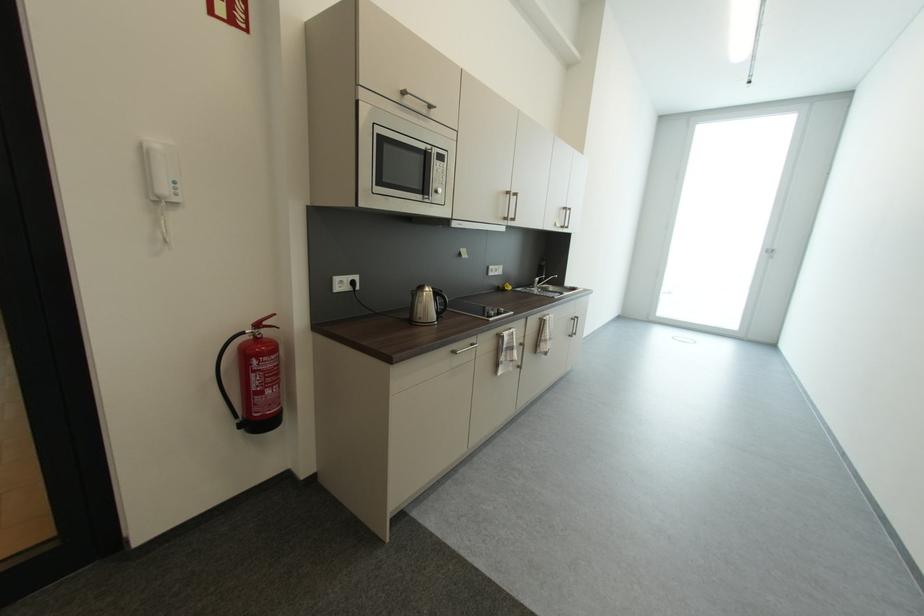
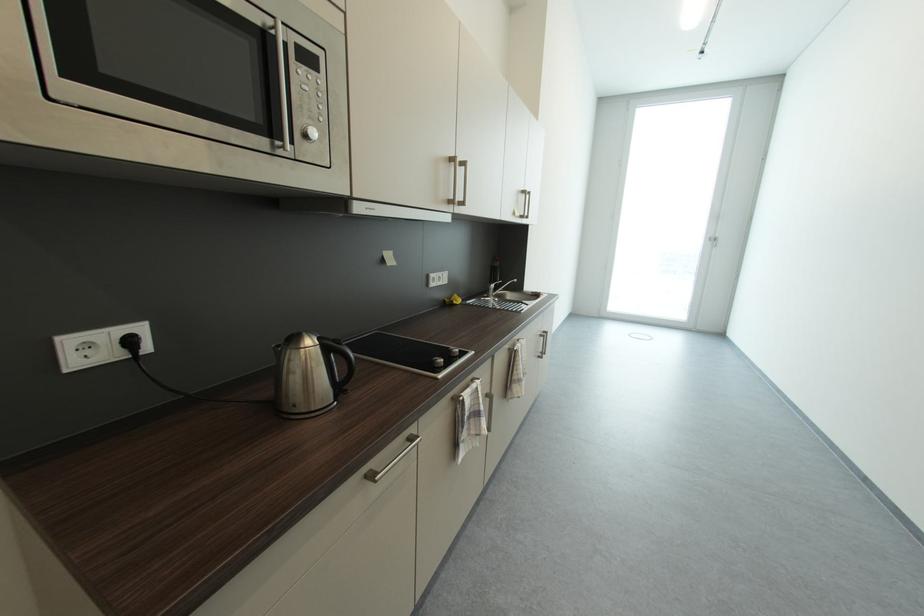
Question: The camera is either moving clockwise (left) or counter-clockwise (right) around the object. The first image is from the beginning of the video and the second image is from the end. Is the camera moving left or right when shooting the video?

Choices:
 (A) Left
 (B) Right

Answer: (A)